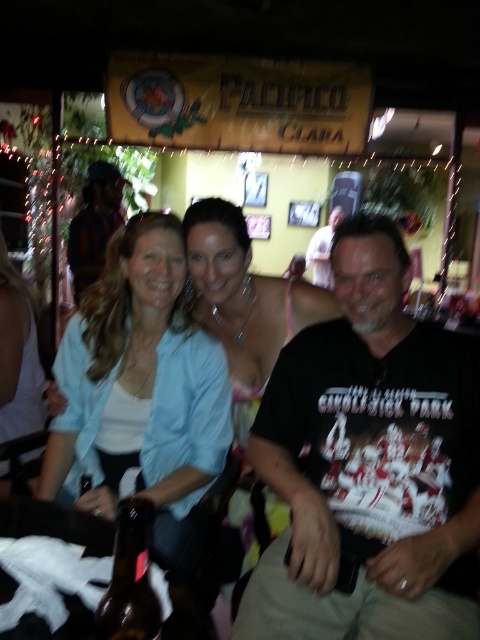
I want to click on matte silver necklace at center, so click(243, 304).

Is matte silver necklace at center wider than dark brown leather jacket at center?

Indeed, matte silver necklace at center has a greater width compared to dark brown leather jacket at center.

Which is in front, point (197, 276) or point (83, 186)?

Point (197, 276)

Locate an element on the screen. The image size is (480, 640). matte silver necklace at center is located at coordinates (243, 304).

Does matte silver necklace at center appear under white t-shirt at center?

Correct, matte silver necklace at center is located below white t-shirt at center.

Measure the distance between matte silver necklace at center and camera.

matte silver necklace at center is 1.41 meters away from camera.

The height and width of the screenshot is (640, 480). In order to click on matte silver necklace at center in this screenshot , I will do [x=243, y=304].

Between point (137, 285) and point (278, 307), which one is positioned behind?

Point (278, 307)

Can you confirm if light blue shirt at center is smaller than matte silver necklace at center?

No.

The height and width of the screenshot is (640, 480). What are the coordinates of `light blue shirt at center` in the screenshot? It's located at (143, 397).